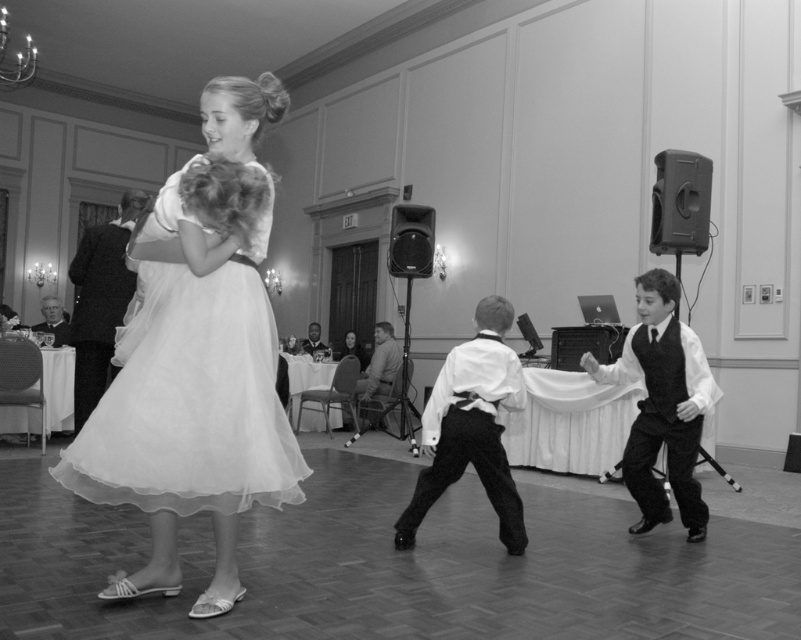
Can you confirm if white satin shirt at center is positioned to the right of metallic speaker at right?

In fact, white satin shirt at center is to the left of metallic speaker at right.

Is white satin shirt at center positioned at the back of metallic speaker at right?

No.

Who is more forward, (502, 369) or (701, 205)?

Point (502, 369)

You are a GUI agent. You are given a task and a screenshot of the screen. Output one action in this format:
    pyautogui.click(x=<x>, y=<y>)
    Task: Click on the white satin shirt at center
    
    Given the screenshot: What is the action you would take?
    pyautogui.click(x=471, y=426)

Between matte white dress at center and white satin shirt at center, which one has more height?

matte white dress at center is taller.

Who is more forward, (91, 428) or (451, 417)?

Positioned in front is point (91, 428).

Where is `matte white dress at center`? The width and height of the screenshot is (801, 640). matte white dress at center is located at coordinates (192, 404).

Who is shorter, matte white dress at center or metallic black speaker at center?

metallic black speaker at center is shorter.

Is point (75, 452) in front of point (400, 228)?

Yes, it is.

The image size is (801, 640). Find the location of `matte white dress at center`. matte white dress at center is located at coordinates (192, 404).